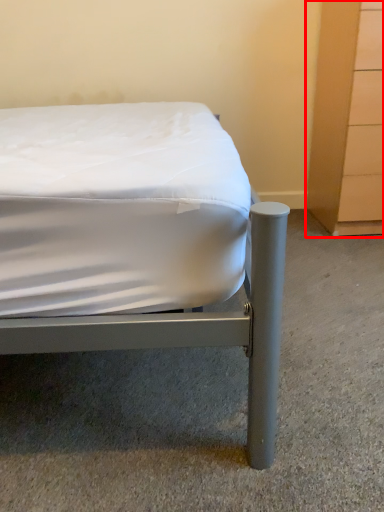
Question: From the image's perspective, where is dresser (annotated by the red box) located relative to bed?

Choices:
 (A) below
 (B) above

Answer: (B)